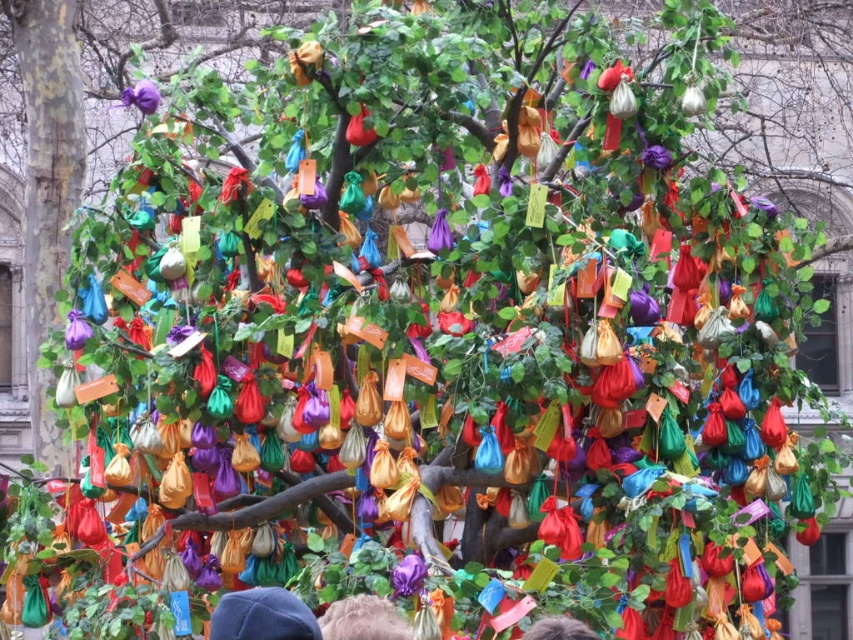
You are a photographer standing in front of the tree with colorful fabric pouches. You notice the blue fabric cap at center and the gray hair at center. Which object would look larger in your camera viewfinder?

The blue fabric cap at center would look larger in the camera viewfinder because it is bigger than the gray hair at center.

You are a photographer trying to capture a clear shot of the blue fabric cap at center and the fuzzy brown hair at center. Since the tree and its decorations are in the way, you need to adjust your camera angle. Which object should you focus on first to ensure it is fully visible?

The blue fabric cap at center is much taller than the fuzzy brown hair at center, so you should focus on the blue fabric cap at center first to ensure it is fully visible.